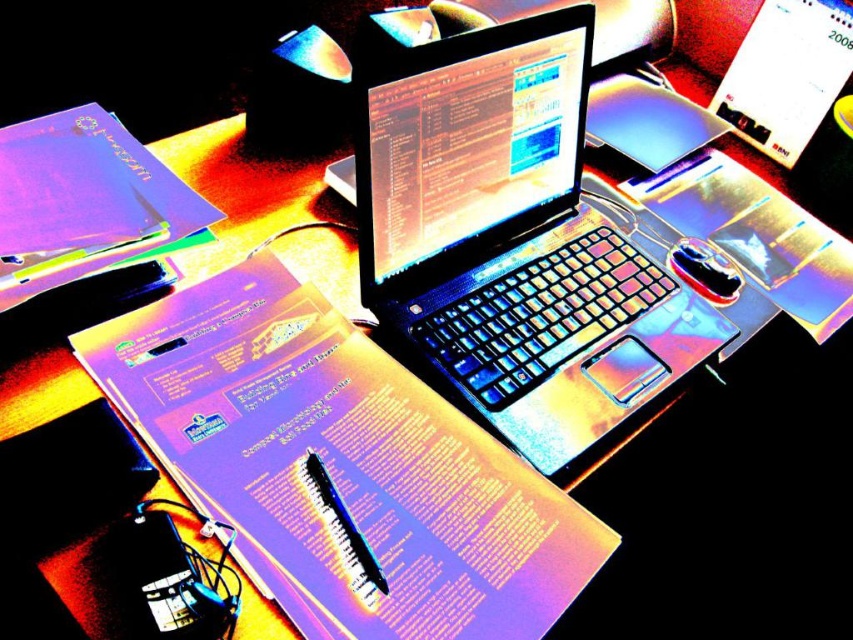
Is satin black laptop at center to the left of metallic glossy mouse at center from the viewer's perspective?

Indeed, satin black laptop at center is positioned on the left side of metallic glossy mouse at center.

Locate an element on the screen. Image resolution: width=853 pixels, height=640 pixels. satin black laptop at center is located at coordinates (508, 234).

Does point (383, 634) come behind point (692, 257)?

No, it is not.

Between matte paper at center and metallic glossy mouse at center, which one is positioned lower?

matte paper at center is lower down.

Is point (415, 428) closer to camera compared to point (706, 266)?

Yes, it is.

Where is `matte paper at center`? matte paper at center is located at coordinates (340, 467).

Does matte paper at center appear under satin black laptop at center?

Correct, matte paper at center is located below satin black laptop at center.

Which is in front, point (544, 596) or point (628, 352)?

Point (544, 596) is more forward.

I want to click on matte paper at center, so click(x=340, y=467).

The width and height of the screenshot is (853, 640). Identify the location of matte paper at center. (340, 467).